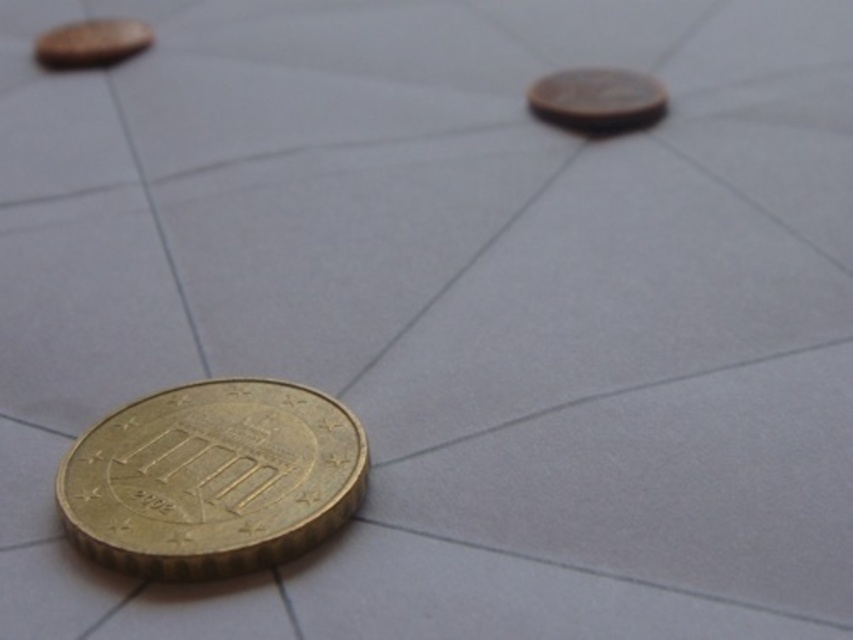
You are standing at the origin point of the tiled surface. You see a gold metallic coin at lower left marked by point (212,477). If you move 0.2 units to the right along the x axis, will you be closer to the coin?

Moving 0.2 units to the right along the x axis from the origin point would take you to position 0.2, 0.0. The coin is located at (212,477). The distance between the new position and the coin is sqrt? 0.548 squared plus 0.25 squared. The original distance from origin to coin is sqrt 0.748 squared plus 0.25 squared. The new distance is sqrt? 0.548 squared plus 0.25 squared. Since 0.548 is less than 0.748, the new distance is smaller. Therefore, yes, you would be closer to the coin after moving right 0.2 on

You are a collector examining two coins on a tiled surface. You have the brass metallic coin at upper right and the matte gold coin at upper left in front of you. Which coin is taller?

The brass metallic coin at upper right is taller than the matte gold coin at upper left.